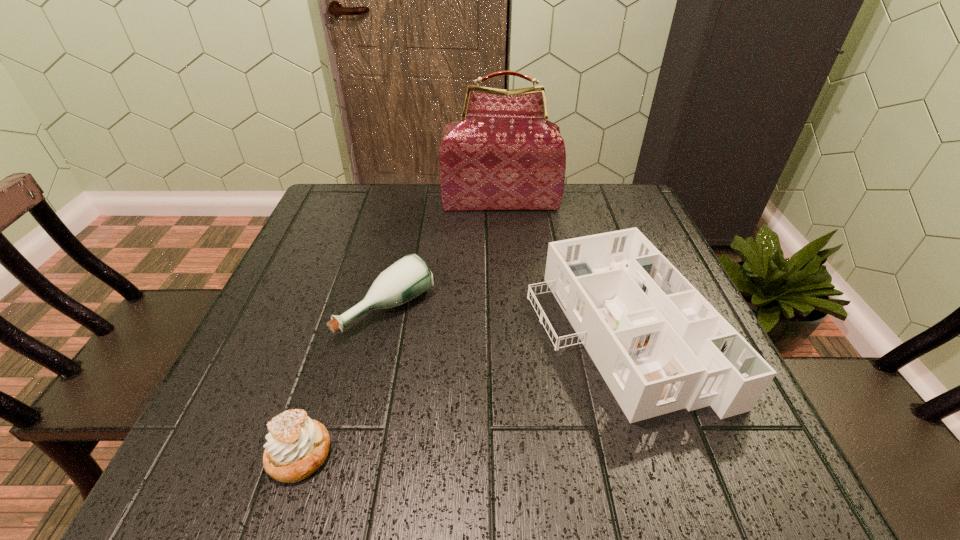
What are the coordinates of `object at the near edge` in the screenshot? It's located at (297, 446).

The width and height of the screenshot is (960, 540). What are the coordinates of `bottle that is at the left edge` in the screenshot? It's located at [x=407, y=278].

This screenshot has height=540, width=960. Identify the location of pastry that is at the left edge. (297, 446).

Where is `object that is at the right edge`? object that is at the right edge is located at coordinates (660, 346).

Locate an element on the screen. Image resolution: width=960 pixels, height=540 pixels. object located in the near left corner section of the desktop is located at coordinates (297, 446).

In the image, there is a desktop. Where is `free space at the far edge`? The width and height of the screenshot is (960, 540). free space at the far edge is located at coordinates (468, 223).

Locate an element on the screen. The width and height of the screenshot is (960, 540). vacant area at the left edge of the desktop is located at coordinates (252, 351).

At what (x,y) coordinates should I click in order to perform the action: click on free region at the far left corner of the desktop. Please return your answer as a coordinate pair (x, y). Looking at the image, I should click on (370, 184).

Where is `vacant region at the far right corner of the desktop`? vacant region at the far right corner of the desktop is located at coordinates (617, 192).

Locate an element on the screen. The height and width of the screenshot is (540, 960). unoccupied area between the bottle and the tallest object is located at coordinates (444, 255).